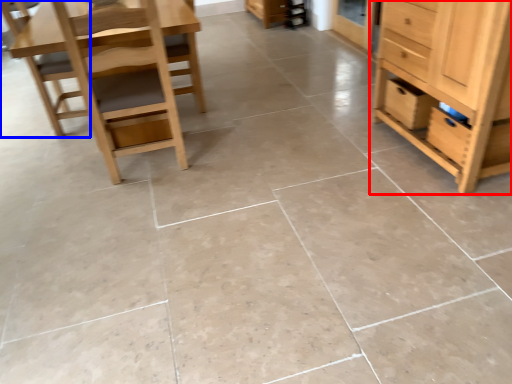
Question: Which object is closer to the camera taking this photo, chest of drawers (highlighted by a red box) or chair (highlighted by a blue box)?

Choices:
 (A) chest of drawers
 (B) chair

Answer: (A)